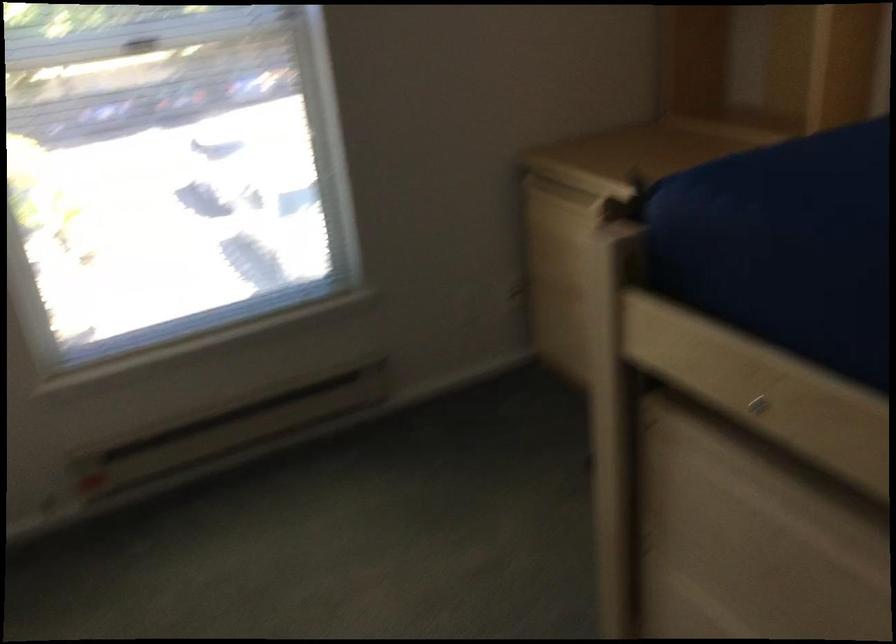
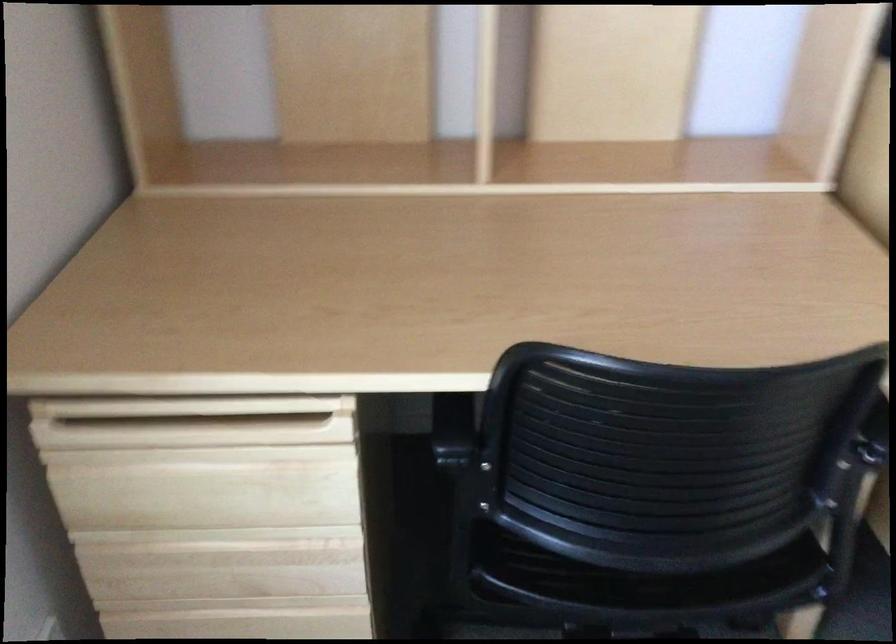
Where in the second image is the point corresponding to pixel 566 198 from the first image?

(192, 422)